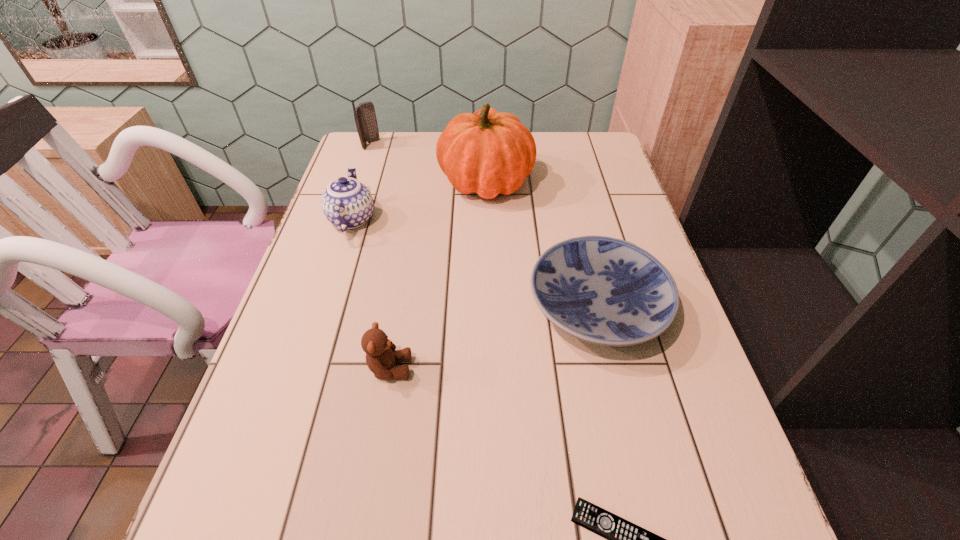
Identify which object is located as the third nearest to the teddy bear. Please provide its 2D coordinates. Your answer should be formatted as a tuple, i.e. [(x, y)], where the tuple contains the x and y coordinates of a point satisfying the conditions above.

[(625, 539)]

In order to click on free spot that satisfies the following two spatial constraints: 1. on the keyboard of the second shortest object; 2. on the left side of the cellular telephone in this screenshot , I will do `click(316, 308)`.

Find the location of a particular element. free space that satisfies the following two spatial constraints: 1. on the front side of the tallest object; 2. on the left side of the fifth tallest object is located at coordinates (488, 308).